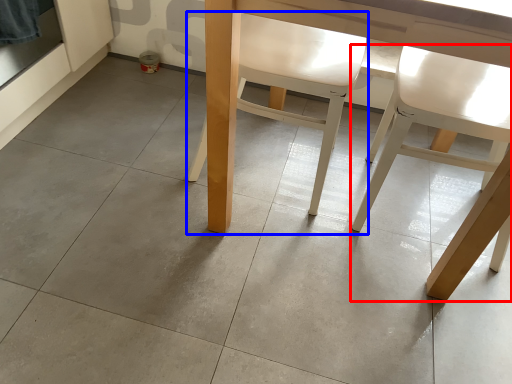
Question: Among these objects, which one is nearest to the camera, chair (highlighted by a red box) or chair (highlighted by a blue box)?

Choices:
 (A) chair
 (B) chair

Answer: (A)